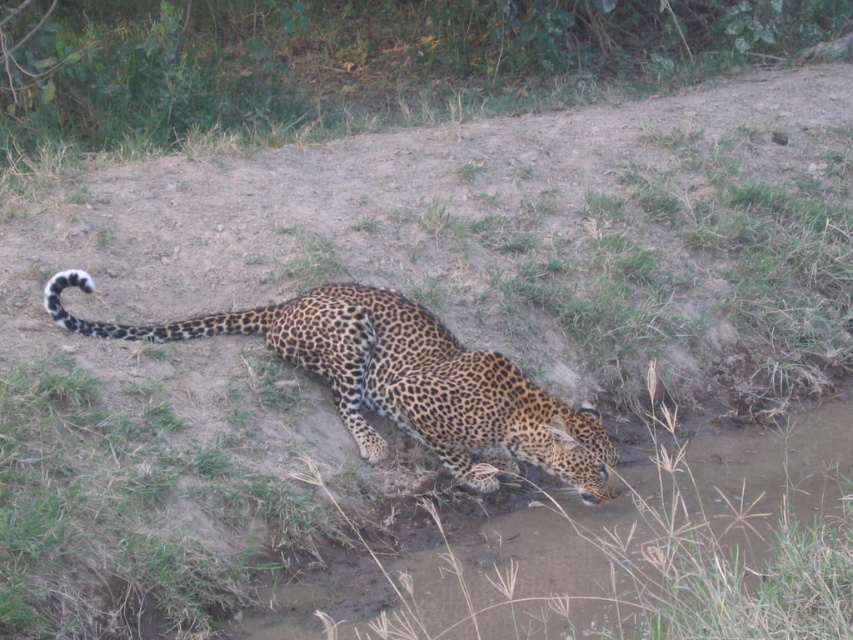
Describe the element at coordinates (399, 380) in the screenshot. I see `spotted fur cheetah at lower center` at that location.

Which is in front, point (418, 307) or point (236, 317)?

Point (418, 307) is in front.

Where is `spotted fur cheetah at lower center`? The image size is (853, 640). spotted fur cheetah at lower center is located at coordinates (399, 380).

Where is `spotted fur cheetah at lower center`? The image size is (853, 640). spotted fur cheetah at lower center is located at coordinates (399, 380).